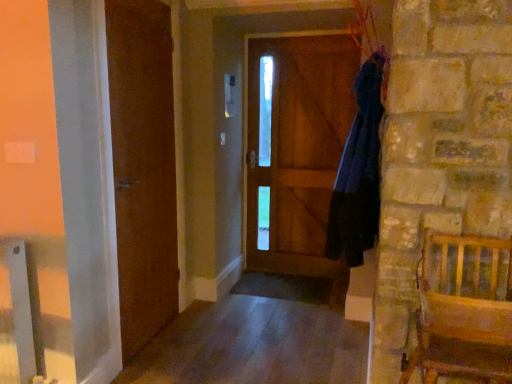
Question: Does smooth wood floor at lower center have a smaller size compared to brown wooden door at left?

Choices:
 (A) no
 (B) yes

Answer: (A)

Question: From the image's perspective, is smooth wood floor at lower center located beneath brown wooden door at left?

Choices:
 (A) no
 (B) yes

Answer: (B)

Question: Does smooth wood floor at lower center come behind brown wooden door at left?

Choices:
 (A) no
 (B) yes

Answer: (A)

Question: Is smooth wood floor at lower center next to brown wooden door at left and touching it?

Choices:
 (A) no
 (B) yes

Answer: (A)

Question: Is smooth wood floor at lower center positioned in front of brown wooden door at left?

Choices:
 (A) yes
 (B) no

Answer: (A)

Question: Does smooth wood floor at lower center have a lesser width compared to brown wooden door at left?

Choices:
 (A) yes
 (B) no

Answer: (B)

Question: Is brown wooden door at left smaller than wooden screen door at center?

Choices:
 (A) no
 (B) yes

Answer: (A)

Question: Is wooden screen door at center inside brown wooden door at left?

Choices:
 (A) no
 (B) yes

Answer: (A)

Question: Is brown wooden door at left taller than wooden screen door at center?

Choices:
 (A) yes
 (B) no

Answer: (A)

Question: From a real-world perspective, is brown wooden door at left on top of wooden screen door at center?

Choices:
 (A) yes
 (B) no

Answer: (A)

Question: From the image's perspective, is brown wooden door at left beneath wooden screen door at center?

Choices:
 (A) no
 (B) yes

Answer: (B)

Question: From a real-world perspective, is brown wooden door at left below wooden screen door at center?

Choices:
 (A) yes
 (B) no

Answer: (B)

Question: Is wooden chair at right directly adjacent to smooth wood floor at lower center?

Choices:
 (A) yes
 (B) no

Answer: (B)